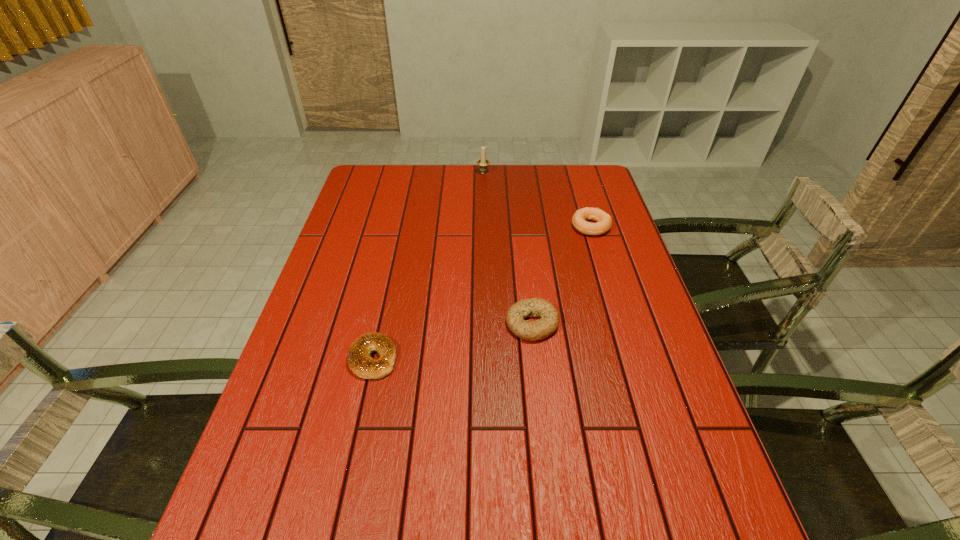
Identify the location of object that is at the left edge. The height and width of the screenshot is (540, 960). (359, 361).

This screenshot has height=540, width=960. What are the coordinates of `object positioned at the right edge` in the screenshot? It's located at (604, 221).

Locate an element on the screen. The image size is (960, 540). free location at the far edge of the desktop is located at coordinates (513, 173).

In the image, there is a desktop. Identify the location of vacant space at the left edge. The image size is (960, 540). (335, 259).

You are a GUI agent. You are given a task and a screenshot of the screen. Output one action in this format:
    pyautogui.click(x=<x>, y=<y>)
    Task: Click on the free space at the right edge
    
    Given the screenshot: What is the action you would take?
    pyautogui.click(x=657, y=383)

This screenshot has width=960, height=540. Identify the location of vacant space at the far left corner. (396, 193).

Image resolution: width=960 pixels, height=540 pixels. Identify the location of vacant space at the far right corner of the desktop. (588, 171).

The image size is (960, 540). I want to click on vacant space that's between the leftmost bagel and the second object from right to left, so click(x=452, y=341).

At what (x,y) coordinates should I click in order to perform the action: click on empty location between the rightmost object and the second object from right to left. Please return your answer as a coordinate pair (x, y). Looking at the image, I should click on (562, 275).

This screenshot has width=960, height=540. Find the location of `vacant area that lies between the tallest object and the farthest bagel`. vacant area that lies between the tallest object and the farthest bagel is located at coordinates (537, 199).